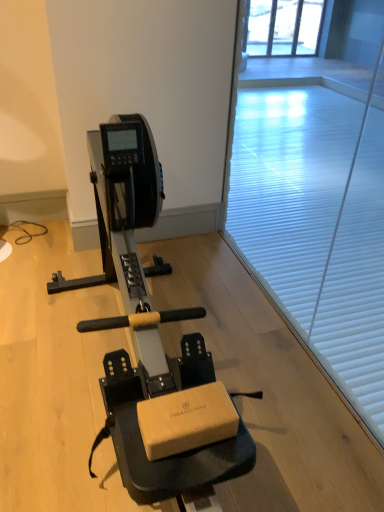
I want to click on free area in between matte black stationary bicycle at center and white matte window screen at center, so click(x=263, y=323).